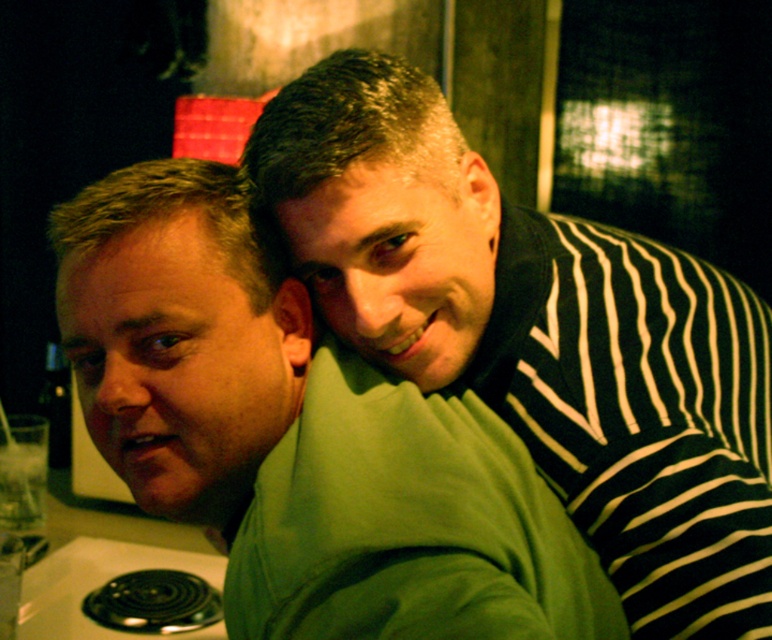
Who is positioned more to the right, green fabric at upper left or green matte sweatshirt at center?

From the viewer's perspective, green fabric at upper left appears more on the right side.

Is green fabric at upper left further to the viewer compared to green matte sweatshirt at center?

That is True.

Is point (442, 250) in front of point (90, 426)?

Yes, it is.

At what (x,y) coordinates should I click in order to perform the action: click on green fabric at upper left. Please return your answer as a coordinate pair (x, y). Image resolution: width=772 pixels, height=640 pixels. Looking at the image, I should click on (539, 333).